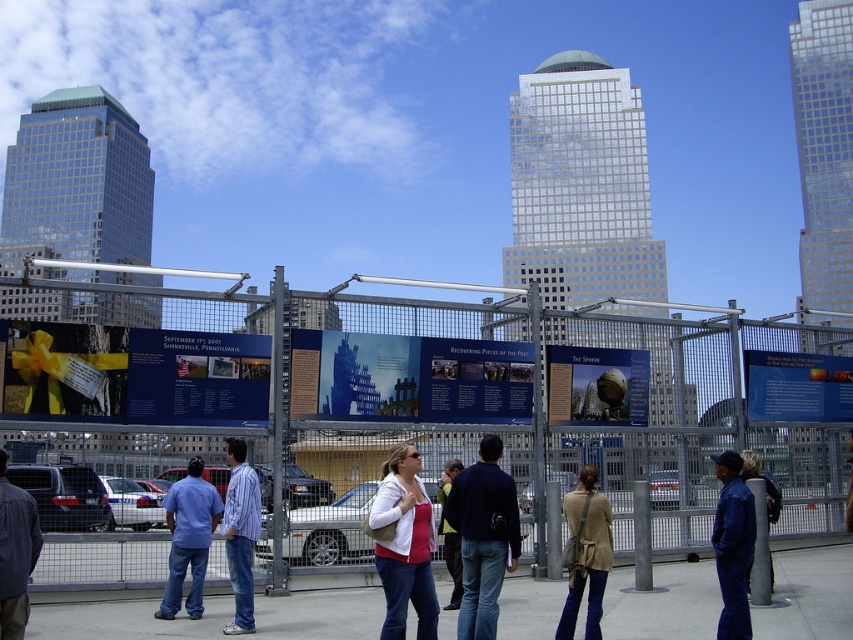
Based on the photo, you are standing in the urban scene described and want to determine the relative positions of two points marked in the image. Which point, point (410, 557) or point (450, 476), is closer to you?

Point (410, 557) is closer to the viewer than point (450, 476).

You are a photographer trying to capture a clear shot of the memorial panels behind the fence. You notice two jackets hanging on the fence at the center, a dark blue jacket at center and a light brown leather jacket at center. Which jacket would block your view less if you position yourself directly in front of them?

The light brown leather jacket at center would block your view less because it is shorter than the dark blue jacket at center, which is taller. Positioning yourself in front of the light brown leather jacket at center would provide a clearer view of the memorial panels.

You are a tourist standing in front of the memorial. You see the metal fence at center and the blue striped shirt at center. Which object is closer to you?

The metal fence at center is closer to you than the blue striped shirt at center because it is positioned over it.